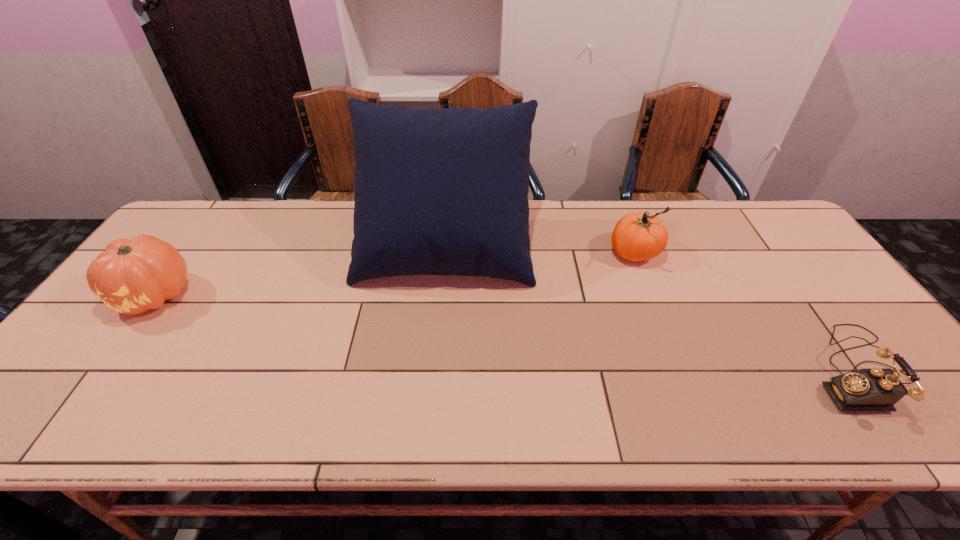
I want to click on free region located on the carved face of the leftmost object, so click(108, 361).

The width and height of the screenshot is (960, 540). I want to click on vacant space situated on the dial of the shortest object, so click(758, 370).

Find the location of `vacant position located on the dial of the shortest object`. vacant position located on the dial of the shortest object is located at coordinates (x=703, y=370).

Identify the location of vacant space located 0.140m on the dial of the shortest object. This screenshot has width=960, height=540. (750, 370).

Find the location of a particular element. Image resolution: width=960 pixels, height=540 pixels. cushion that is at the far edge is located at coordinates (440, 191).

Locate an element on the screen. This screenshot has height=540, width=960. pumpkin positioned at the far edge is located at coordinates (637, 236).

Identify the location of object at the near edge. (875, 389).

This screenshot has height=540, width=960. I want to click on object located in the left edge section of the desktop, so click(x=133, y=276).

The image size is (960, 540). I want to click on object located in the right edge section of the desktop, so click(x=875, y=389).

In order to click on object at the near right corner in this screenshot , I will do `click(875, 389)`.